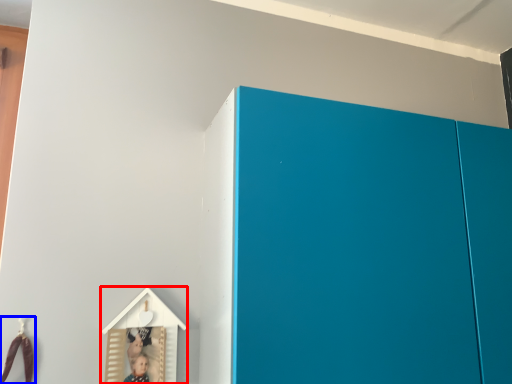
Question: Which of the following is the closest to the observer, toy (highlighted by a red box) or toy (highlighted by a blue box)?

Choices:
 (A) toy
 (B) toy

Answer: (B)